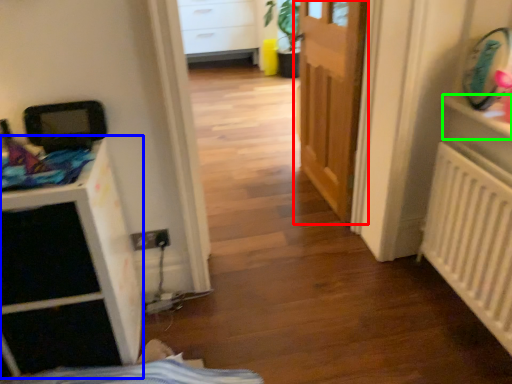
Question: Which is farther away from door (highlighted by a red box)? file cabinet (highlighted by a blue box) or shelf (highlighted by a green box)?

Choices:
 (A) file cabinet
 (B) shelf

Answer: (A)